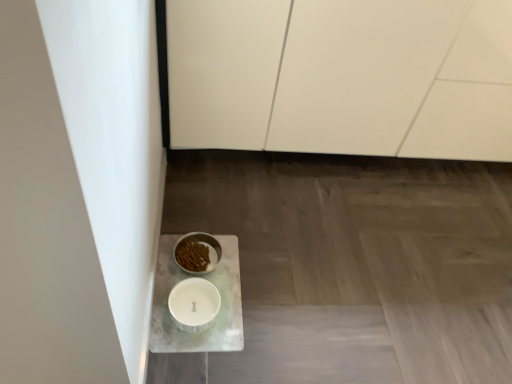
This screenshot has width=512, height=384. In order to click on white glossy bowl at lower left, which ranks as the 2th tableware in top-to-bottom order in this screenshot , I will do `click(194, 304)`.

Describe the element at coordinates (219, 310) in the screenshot. The image size is (512, 384). I see `white marble tray at lower left` at that location.

In order to face white glossy bowl at lower left, acting as the 2th tableware starting from the bottom, should I rotate leftwards or rightwards?

You should look left and rotate roughly 7.965 degrees.

Locate an element on the screen. This screenshot has height=384, width=512. white matte cabinet at upper center is located at coordinates [342, 76].

Where is `white marble tray at lower left`? The width and height of the screenshot is (512, 384). white marble tray at lower left is located at coordinates (355, 265).

Where is `white glossy bowl at lower left, which ranks as the 2th tableware in top-to-bottom order`? white glossy bowl at lower left, which ranks as the 2th tableware in top-to-bottom order is located at coordinates (194, 304).

Is point (502, 272) in front of point (239, 337)?

No, (502, 272) is further to viewer.

Is white marble tray at lower left positioned with its back to white marble tray at lower left?

No, white marble tray at lower left's orientation is not away from white marble tray at lower left.

Considering the relative sizes of white marble tray at lower left and white marble tray at lower left in the image provided, is white marble tray at lower left smaller than white marble tray at lower left?

No, white marble tray at lower left is not smaller than white marble tray at lower left.

Is white marble tray at lower left not near white marble tray at lower left?

Actually, white marble tray at lower left and white marble tray at lower left are a little close together.

The width and height of the screenshot is (512, 384). What are the coordinates of `cabinetry above the white marble tray at lower left (from a real-world perspective)` in the screenshot? It's located at (342, 76).

Is point (384, 350) more distant than point (351, 115)?

No, it is in front of (351, 115).

Does white marble tray at lower left have a larger size compared to white matte cabinet at upper center?

Actually, white marble tray at lower left might be smaller than white matte cabinet at upper center.

Based on the photo, in the image, is white marble tray at lower left on the left side or the right side of white matte cabinet at upper center?

In the image, white marble tray at lower left appears on the left side of white matte cabinet at upper center.

Is point (292, 245) closer or farther from the camera than point (201, 232)?

Point (292, 245) appears to be farther away from the viewer than point (201, 232).

Is white marble tray at lower left next to white glossy bowl at lower left, acting as the 2th tableware starting from the bottom, and touching it?

No.

From the image's perspective, between white marble tray at lower left and white glossy bowl at lower left, acting as the 2th tableware starting from the bottom, which one is located above?

From the image's view, white glossy bowl at lower left, acting as the 2th tableware starting from the bottom, is above.

Is white marble tray at lower left wider than white glossy bowl at lower left, arranged as the first tableware when viewed from the top?

Correct, the width of white marble tray at lower left exceeds that of white glossy bowl at lower left, arranged as the first tableware when viewed from the top.

In the image, is white glossy bowl at lower left, which ranks as the 2th tableware in top-to-bottom order, positioned in front of or behind white marble tray at lower left?

Visually, white glossy bowl at lower left, which ranks as the 2th tableware in top-to-bottom order, is located behind white marble tray at lower left.

Which of these two, white glossy bowl at lower left, arranged as the first tableware when ordered from the bottom, or white marble tray at lower left, is thinner?

white glossy bowl at lower left, arranged as the first tableware when ordered from the bottom, is thinner.

Is white glossy bowl at lower left, which ranks as the 2th tableware in top-to-bottom order, placed right next to white marble tray at lower left?

Yes, white glossy bowl at lower left, which ranks as the 2th tableware in top-to-bottom order, is beside white marble tray at lower left.

Consider the image. From a real-world perspective, is white glossy bowl at lower left, acting as the 2th tableware starting from the bottom, below white marble tray at lower left?

Actually, white glossy bowl at lower left, acting as the 2th tableware starting from the bottom, is physically above white marble tray at lower left in the real world.

How many degrees apart are the facing directions of white glossy bowl at lower left, acting as the 2th tableware starting from the bottom, and white marble tray at lower left?

They differ by 180 degrees in their facing directions.

Is point (175, 257) closer to viewer compared to point (397, 295)?

Yes.

Is white marble tray at lower left oriented towards white marble tray at lower left?

Yes, white marble tray at lower left is aimed at white marble tray at lower left.

Which object is positioned more to the left, white marble tray at lower left or white marble tray at lower left?

white marble tray at lower left.

From the picture: From the image's perspective, between white marble tray at lower left and white marble tray at lower left, which one is located above?

white marble tray at lower left.

Is point (162, 253) less distant than point (306, 376)?

No, it is behind (306, 376).

Is white glossy bowl at lower left, acting as the 2th tableware starting from the bottom, taller or shorter than white marble tray at lower left?

In the image, white glossy bowl at lower left, acting as the 2th tableware starting from the bottom, appears to be taller than white marble tray at lower left.

Is the position of white glossy bowl at lower left, arranged as the first tableware when viewed from the top, more distant than that of white marble tray at lower left?

Yes, white glossy bowl at lower left, arranged as the first tableware when viewed from the top, is behind white marble tray at lower left.

Are white glossy bowl at lower left, acting as the 2th tableware starting from the bottom, and white marble tray at lower left beside each other?

white glossy bowl at lower left, acting as the 2th tableware starting from the bottom, and white marble tray at lower left are not in contact.

This screenshot has height=384, width=512. Identify the location of table below the white marble tray at lower left (from the image's perspective). (219, 310).

Locate an element on the screen. Image resolution: width=512 pixels, height=384 pixels. cabinetry above the white marble tray at lower left (from the image's perspective) is located at coordinates (342, 76).

When comparing their distances from white marble tray at lower left, does white matte cabinet at upper center or white glossy bowl at lower left, acting as the 2th tableware starting from the bottom, seem further?

Among the two, white matte cabinet at upper center is located further to white marble tray at lower left.

From the picture: Which object lies further to the anchor point white glossy bowl at lower left, arranged as the first tableware when viewed from the top, white matte cabinet at upper center or white marble tray at lower left?

Based on the image, white matte cabinet at upper center appears to be further to white glossy bowl at lower left, arranged as the first tableware when viewed from the top.

In the scene shown: From the image, which object appears to be farther from white matte cabinet at upper center, white marble tray at lower left or white glossy bowl at lower left, arranged as the first tableware when ordered from the bottom?

white glossy bowl at lower left, arranged as the first tableware when ordered from the bottom, lies further to white matte cabinet at upper center than the other object.

When comparing their distances from white marble tray at lower left, does white glossy bowl at lower left, which ranks as the 2th tableware in top-to-bottom order, or white glossy bowl at lower left, arranged as the first tableware when viewed from the top, seem further?

Based on the image, white glossy bowl at lower left, which ranks as the 2th tableware in top-to-bottom order, appears to be further to white marble tray at lower left.

Based on their spatial positions, is white glossy bowl at lower left, arranged as the first tableware when viewed from the top, or white matte cabinet at upper center closer to white marble tray at lower left?

white glossy bowl at lower left, arranged as the first tableware when viewed from the top, is positioned closer to the anchor white marble tray at lower left.

Based on their spatial positions, is white matte cabinet at upper center or white marble tray at lower left further from white glossy bowl at lower left, which ranks as the 2th tableware in top-to-bottom order?

white matte cabinet at upper center is further to white glossy bowl at lower left, which ranks as the 2th tableware in top-to-bottom order.

Estimate the real-world distances between objects in this image. Which object is further from white glossy bowl at lower left, which ranks as the 2th tableware in top-to-bottom order, white matte cabinet at upper center or white marble tray at lower left?

white matte cabinet at upper center.

Which object lies further to the anchor point white glossy bowl at lower left, which ranks as the 2th tableware in top-to-bottom order, white marble tray at lower left or white matte cabinet at upper center?

white matte cabinet at upper center is further to white glossy bowl at lower left, which ranks as the 2th tableware in top-to-bottom order.

Image resolution: width=512 pixels, height=384 pixels. In order to click on tableware that lies between white matte cabinet at upper center and white marble tray at lower left from top to bottom in this screenshot , I will do `click(205, 245)`.

The width and height of the screenshot is (512, 384). In order to click on table situated between white glossy bowl at lower left, arranged as the first tableware when viewed from the top, and white marble tray at lower left from left to right in this screenshot , I will do `click(219, 310)`.

You are a GUI agent. You are given a task and a screenshot of the screen. Output one action in this format:
    pyautogui.click(x=<x>, y=<y>)
    Task: Click on the concrete that lies between white matte cabinet at upper center and white marble tray at lower left from top to bottom
    
    Given the screenshot: What is the action you would take?
    pyautogui.click(x=355, y=265)

This screenshot has width=512, height=384. In order to click on table between white glossy bowl at lower left, which ranks as the 2th tableware in top-to-bottom order, and white marble tray at lower left in this screenshot , I will do `click(219, 310)`.